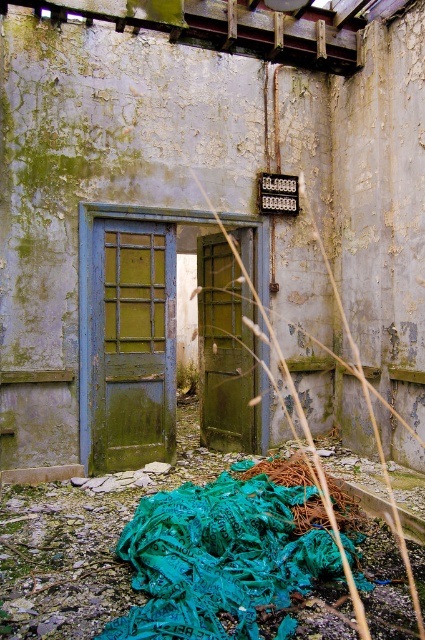
You are inside an abandoned building and see two doors. The first is the green matte door at left and the second is the green matte door at center. Which door is higher up in the room?

The green matte door at left is located above the green matte door at center, so it is higher up in the room.

Based on the coordinates provided, which object in the scene is located at point (133, 342)?

The green matte door at left is located at point (133, 342).